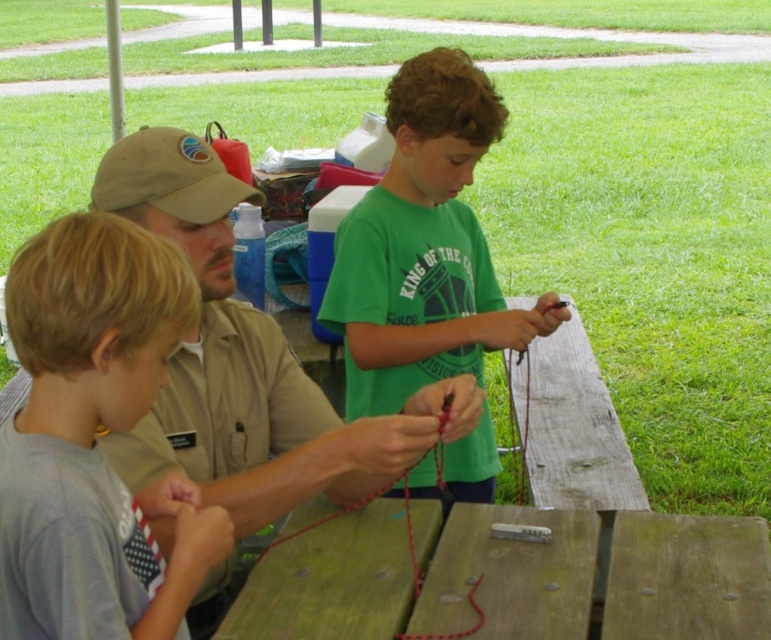
Is wooden at center below khaki fabric shirt at center?

Correct, wooden at center is located below khaki fabric shirt at center.

Is point (381, 560) positioned before point (120, 186)?

No, it is behind (120, 186).

Does point (512, 508) come closer to viewer compared to point (234, 371)?

No, it is behind (234, 371).

Identify the location of wooden at center. (423, 579).

Between wooden at center and green matte shirt at center, which one is positioned lower?

wooden at center

Is point (379, 513) positioned after point (465, 177)?

No, it is not.

Which is behind, point (641, 586) or point (453, 74)?

The point (453, 74) is behind.

What are the coordinates of `wooden at center` in the screenshot? It's located at (423, 579).

Which of these two, wooden at center or gray cotton shirt at left, stands shorter?

Standing shorter between the two is wooden at center.

Measure the distance between wooden at center and camera.

wooden at center is 1.47 meters from camera.

I want to click on wooden at center, so click(x=423, y=579).